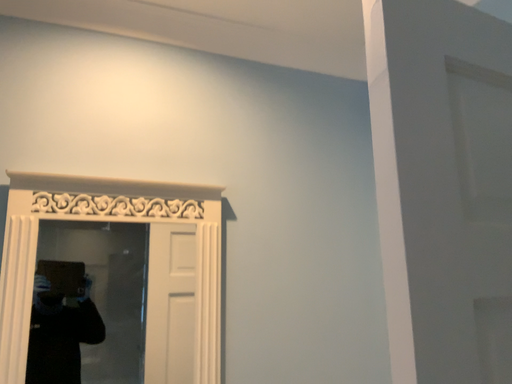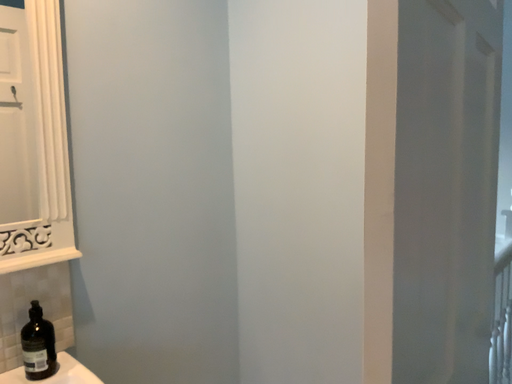
Question: Which way did the camera rotate in the video?

Choices:
 (A) rotated right
 (B) rotated left

Answer: (A)